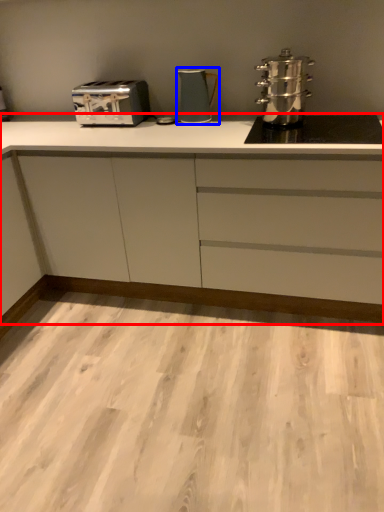
Question: Among these objects, which one is farthest to the camera, cabinetry (highlighted by a red box) or kitchen appliance (highlighted by a blue box)?

Choices:
 (A) cabinetry
 (B) kitchen appliance

Answer: (B)